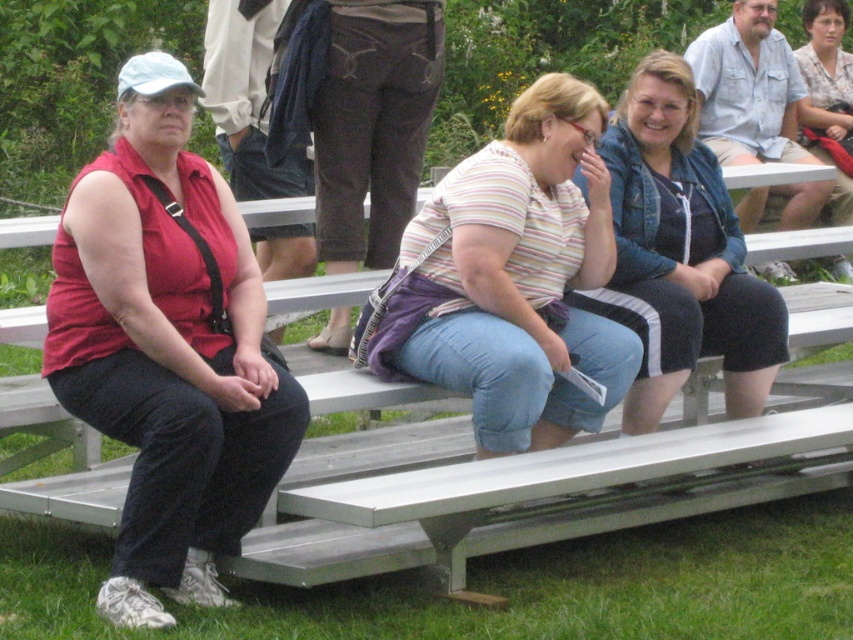
Does striped cotton shirt at center have a lesser height compared to denim jacket at center?

Yes, striped cotton shirt at center is shorter than denim jacket at center.

Does striped cotton shirt at center appear on the left side of denim jacket at center?

Indeed, striped cotton shirt at center is positioned on the left side of denim jacket at center.

Who is more distant from viewer, (459, 182) or (612, 163)?

The point (612, 163) is more distant.

This screenshot has height=640, width=853. In order to click on striped cotton shirt at center in this screenshot , I will do `click(509, 280)`.

Who is higher up, matte red shirt at left or metallic silver bench at center?

Positioned higher is matte red shirt at left.

Does point (265, 440) lie behind point (397, 483)?

No, it is in front of (397, 483).

What are the coordinates of `matte red shirt at left` in the screenshot? It's located at (167, 349).

Can you confirm if striped cotton shirt at center is bigger than striped fabric shirt at center?

Yes.

Is striped cotton shirt at center smaller than striped fabric shirt at center?

Incorrect, striped cotton shirt at center is not smaller in size than striped fabric shirt at center.

Find the location of a particular element. The height and width of the screenshot is (640, 853). striped cotton shirt at center is located at coordinates (509, 280).

You are a GUI agent. You are given a task and a screenshot of the screen. Output one action in this format:
    pyautogui.click(x=<x>, y=<y>)
    Task: Click on the striped cotton shirt at center
    Image resolution: width=853 pixels, height=640 pixels.
    Given the screenshot: What is the action you would take?
    pyautogui.click(x=509, y=280)